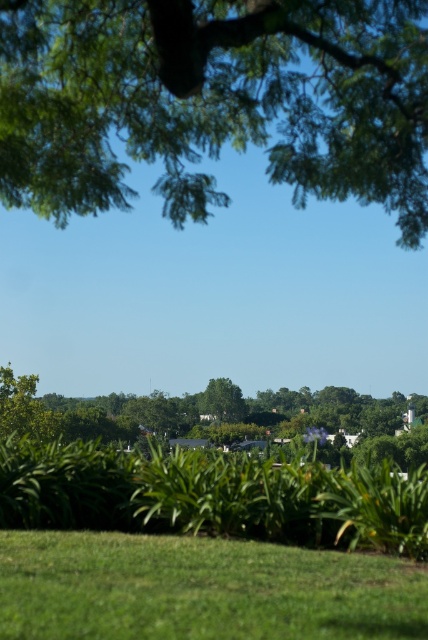
You are standing in the middle of the green grassy field at lower center and want to reach the green leafy tree at upper center. Which direction should you walk to get closer to the tree?

You should walk towards the upper center direction to get closer to the green leafy tree at upper center since it is taller than the green grassy field at lower center.

You are standing in the outdoor scene and want to walk from the point at coordinates point [240,592] to the point at coordinates point [372,406]. Which direction should you move relative to your current position?

Since point [240,592] is closer to the camera than point [372,406], you should move towards the background to reach point [372,406] from point [240,592].

You are standing on the green grassy field at lower center and want to walk to the green leafy tree at center. Which direction should you move in to get closer to the tree?

The green grassy field at lower center is located above the green leafy tree at center, so to reach the tree, you should move downward from the green grassy field at lower center towards the green leafy tree at center.